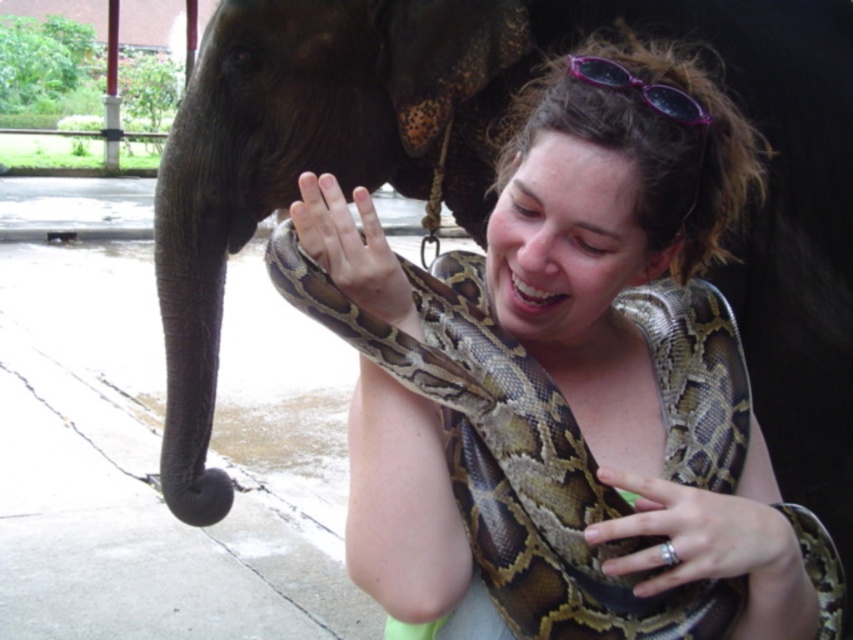
You are a photographer trying to capture the perfect shot of the brown patterned snake at center and the purple plastic goggles at upper center. Since you want to highlight both objects in your photo, which object should you focus on first to ensure proper focus and composition?

The brown patterned snake at center has a greater height compared to the purple plastic goggles at upper center, so you should focus on the brown patterned snake at center first to ensure it is in focus before adjusting for the smaller purple plastic goggles at upper center.

You are a wildlife photographer trying to capture a clear image of both the brown patterned snake at center and the brown textured snake at center. Which snake should you focus on first if you want to ensure the wider one is in focus?

The brown patterned snake at center might be wider than brown textured snake at center, so you should focus on the brown patterned snake at center first to ensure it is in focus.

You are standing at the origin point in the image. You want to walk towards the point labeled as point (546, 346). However, there is an obstacle at point (618, 81). Will you encounter the obstacle before reaching your destination?

Yes, because point (546, 346) is behind point (618, 81), so you will hit the obstacle at point (618, 81) first.